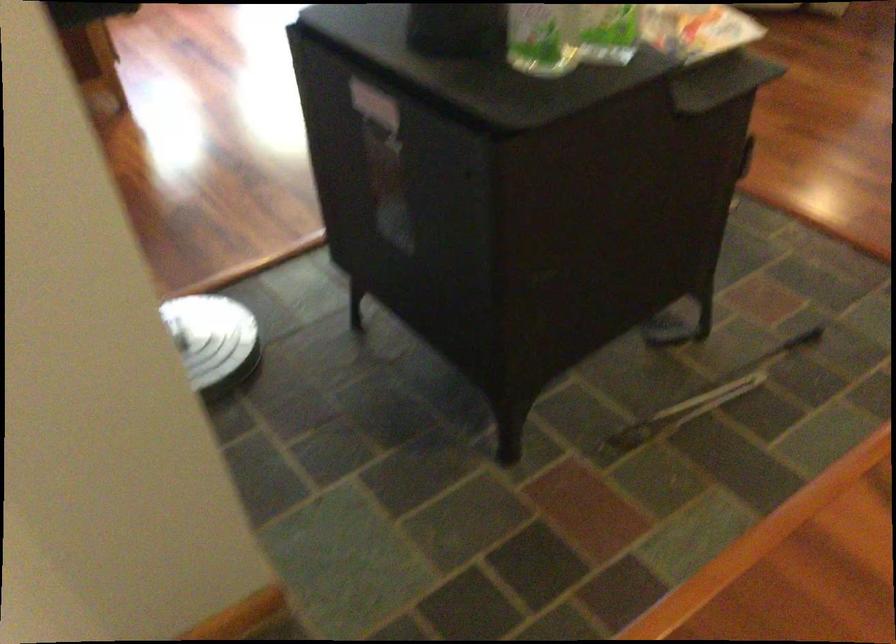
Where would you pull the stove door handle? Please return your answer as a coordinate pair (x, y).

(375, 104)